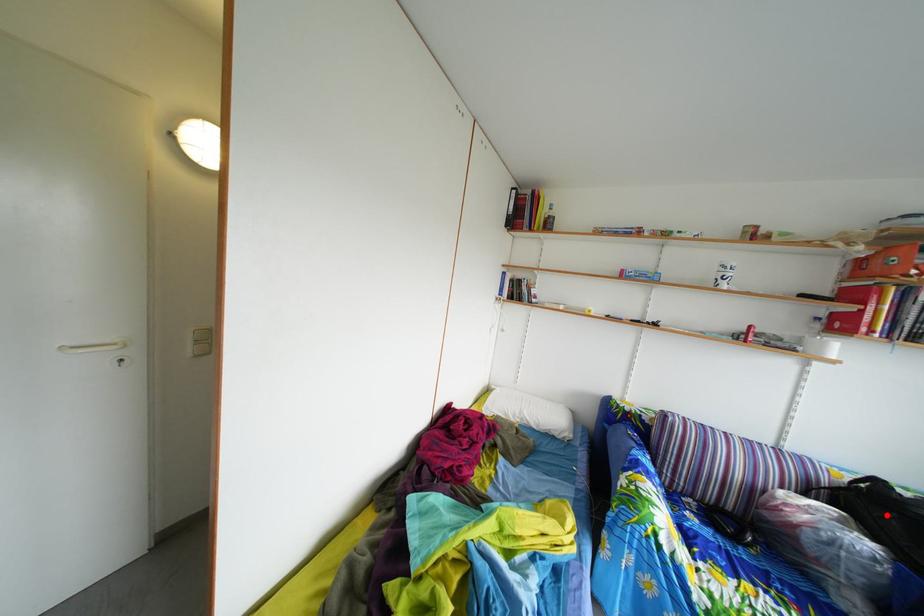
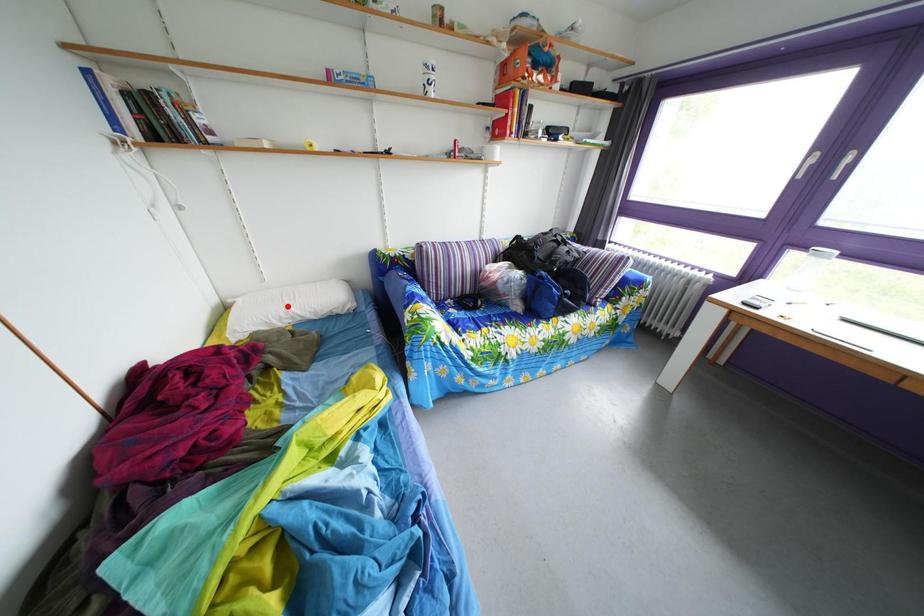
I am providing you with two images of the same scene from different viewpoints. A red point is marked on the first image and another point is marked on the second image. Are the points marked in image1 and image2 representing the same 3D position?

No